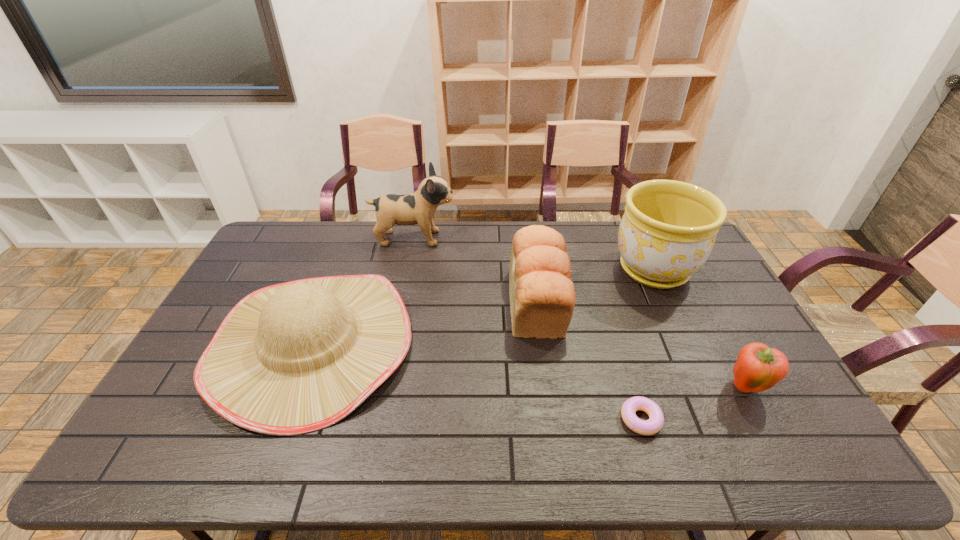
You are a GUI agent. You are given a task and a screenshot of the screen. Output one action in this format:
    pyautogui.click(x=<x>, y=<y>)
    Task: Click on the vacant area situated 0.070m on the right of the sunhat
    This screenshot has width=960, height=540.
    Given the screenshot: What is the action you would take?
    pyautogui.click(x=435, y=344)

At what (x,y) coordinates should I click in order to perform the action: click on vacant space located on the back of the pepper. Please return your answer as a coordinate pair (x, y). Looking at the image, I should click on (710, 322).

In order to click on free region located on the back of the third object from right to left in this screenshot , I will do `click(611, 319)`.

Where is `puppy located in the far edge section of the desktop`? Image resolution: width=960 pixels, height=540 pixels. puppy located in the far edge section of the desktop is located at coordinates (419, 208).

This screenshot has width=960, height=540. I want to click on flowerpot present at the far edge, so click(668, 230).

You are a GUI agent. You are given a task and a screenshot of the screen. Output one action in this format:
    pyautogui.click(x=<x>, y=<y>)
    Task: Click on the sunhat located at the near edge
    This screenshot has width=960, height=540.
    Given the screenshot: What is the action you would take?
    pyautogui.click(x=293, y=358)

You are a GUI agent. You are given a task and a screenshot of the screen. Output one action in this format:
    pyautogui.click(x=<x>, y=<y>)
    Task: Click on the doughnut present at the near edge
    This screenshot has height=540, width=960.
    Given the screenshot: What is the action you would take?
    pyautogui.click(x=656, y=418)

You are a GUI agent. You are given a task and a screenshot of the screen. Output one action in this format:
    pyautogui.click(x=<x>, y=<y>)
    Task: Click on the object positioned at the left edge
    
    Given the screenshot: What is the action you would take?
    293,358

At what (x,y) coordinates should I click in order to perform the action: click on flowerpot that is at the right edge. Please return your answer as a coordinate pair (x, y). Looking at the image, I should click on (668, 230).

Where is `pepper located in the right edge section of the desktop`? The image size is (960, 540). pepper located in the right edge section of the desktop is located at coordinates pyautogui.click(x=758, y=368).